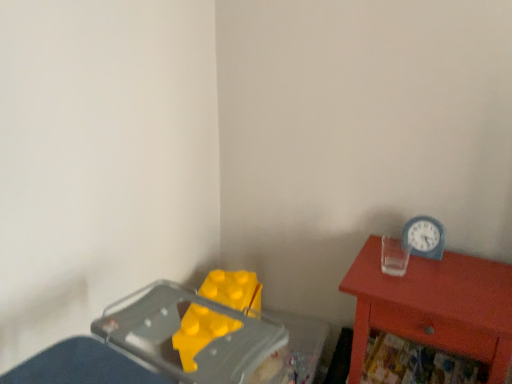
This screenshot has width=512, height=384. I want to click on free space in front of blue plastic clock at upper right, so click(439, 281).